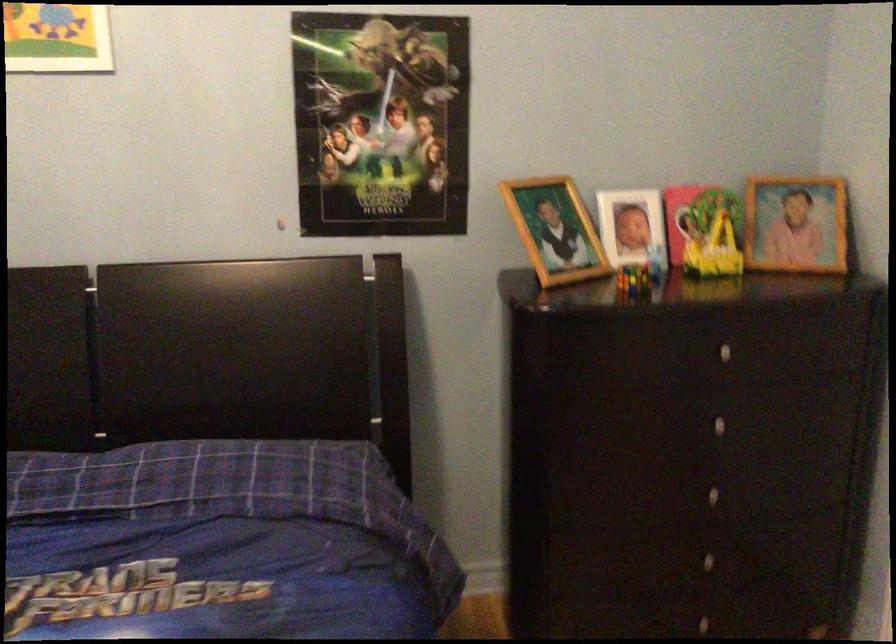
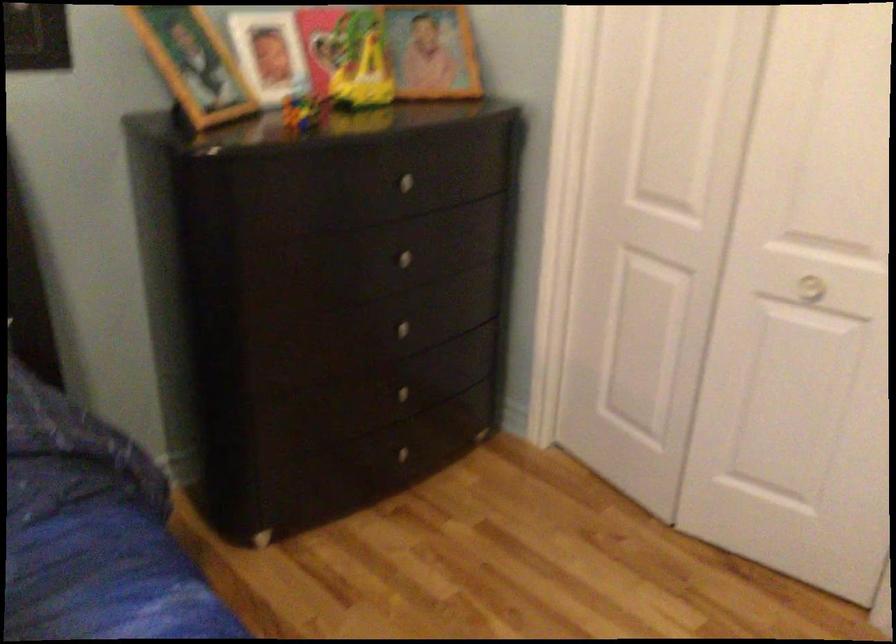
The point at (702,558) is marked in the first image. Where is the corresponding point in the second image?

(400, 393)